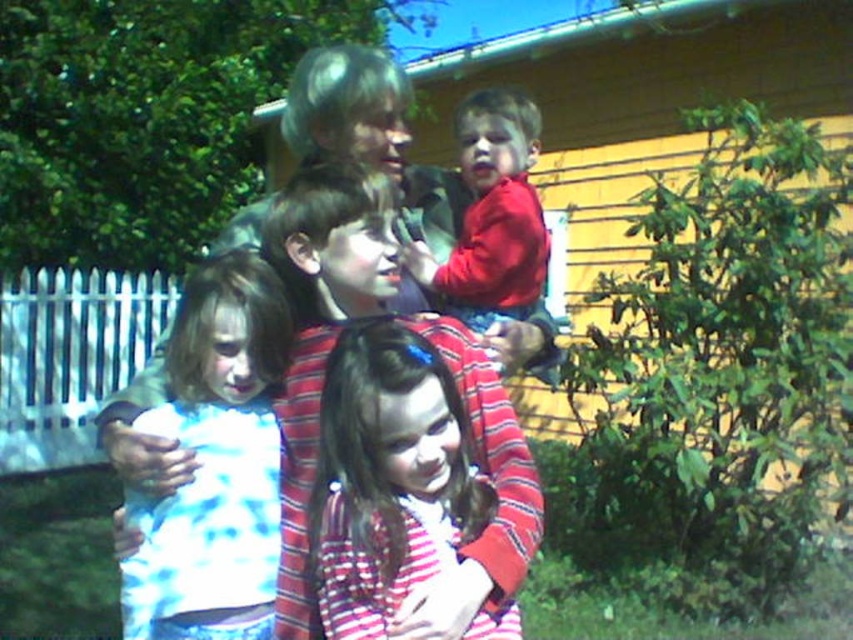
Is striped fabric shirt at center to the right of matte red shirt at center from the viewer's perspective?

Incorrect, striped fabric shirt at center is not on the right side of matte red shirt at center.

Who is more forward, (450, 465) or (496, 189)?

Point (450, 465) is in front.

Locate an element on the screen. striped fabric shirt at center is located at coordinates (387, 476).

Does white tie-dye shirt at center have a lesser height compared to striped fabric shirt at center?

In fact, white tie-dye shirt at center may be taller than striped fabric shirt at center.

Between white tie-dye shirt at center and striped fabric shirt at center, which one has less height?

Standing shorter between the two is striped fabric shirt at center.

Locate an element on the screen. The width and height of the screenshot is (853, 640). white tie-dye shirt at center is located at coordinates (215, 464).

Which is in front, point (198, 451) or point (532, 298)?

Point (198, 451) is more forward.

Find the location of `white tie-dye shirt at center`. white tie-dye shirt at center is located at coordinates (215, 464).